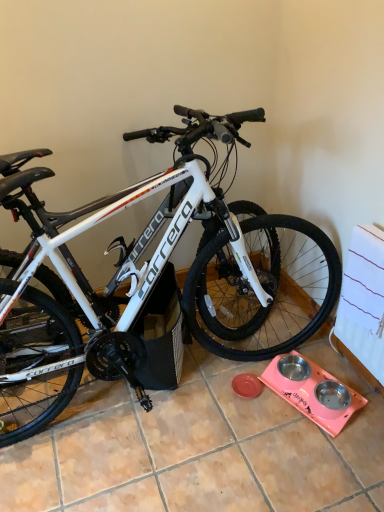
You are a GUI agent. You are given a task and a screenshot of the screen. Output one action in this format:
    pyautogui.click(x=<x>, y=<y>)
    Task: Click on the white matte bicycle at center
    
    Given the screenshot: What is the action you would take?
    pyautogui.click(x=110, y=281)

Image resolution: width=384 pixels, height=512 pixels. Describe the element at coordinates (110, 281) in the screenshot. I see `white matte bicycle at center` at that location.

Where is `white matte bicycle at center`? white matte bicycle at center is located at coordinates (110, 281).